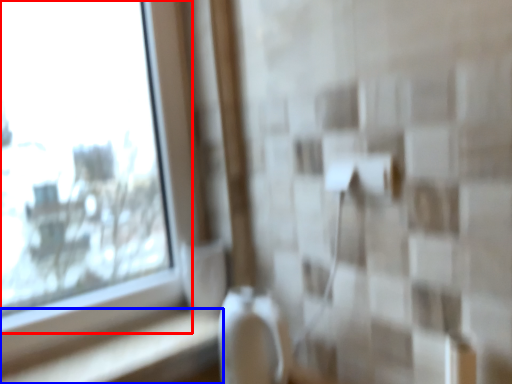
Question: Which point is closer to the camera, window (highlighted by a red box) or ledge (highlighted by a blue box)?

Choices:
 (A) window
 (B) ledge

Answer: (A)